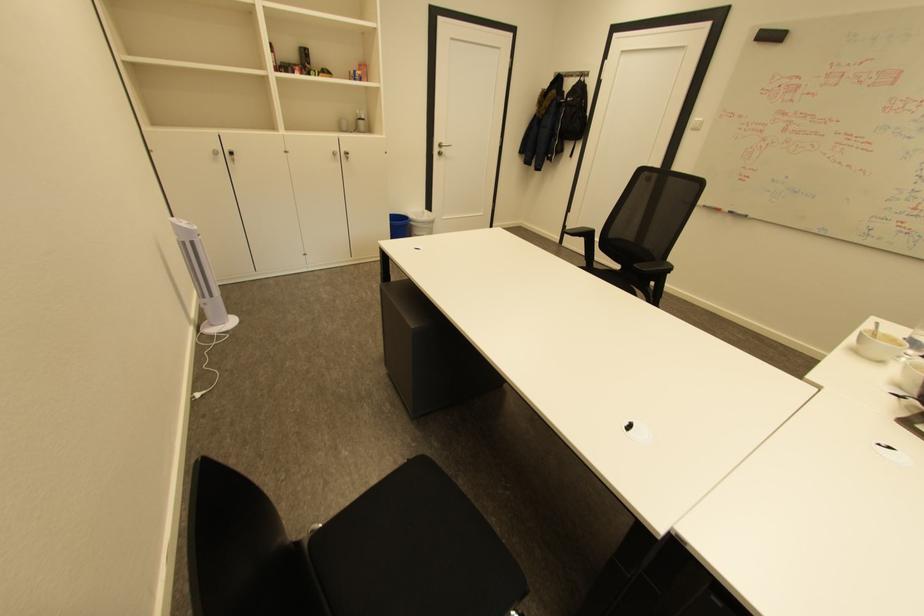
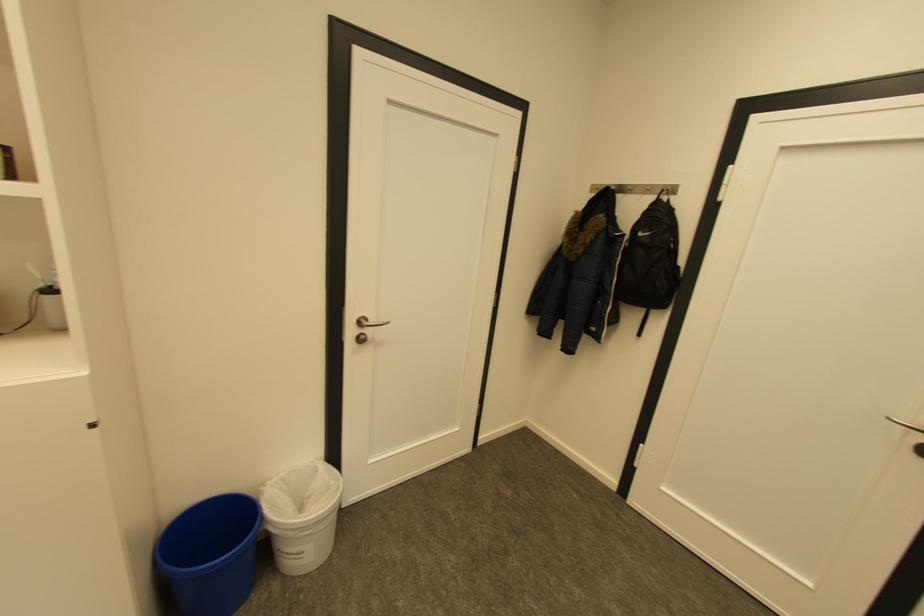
Question: In a continuous first-person perspective shot, in which direction is the camera moving?

Choices:
 (A) Left
 (B) Right
 (C) Forward
 (D) Backward

Answer: (C)